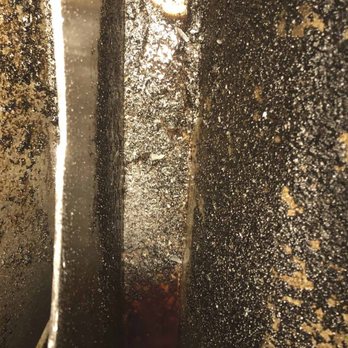
You are a GUI agent. You are given a task and a screenshot of the screen. Output one action in this format:
    pyautogui.click(x=<x>, y=<y>)
    Task: Click on the left wall
    This screenshot has width=348, height=348.
    Given the screenshot: What is the action you would take?
    click(x=80, y=120)